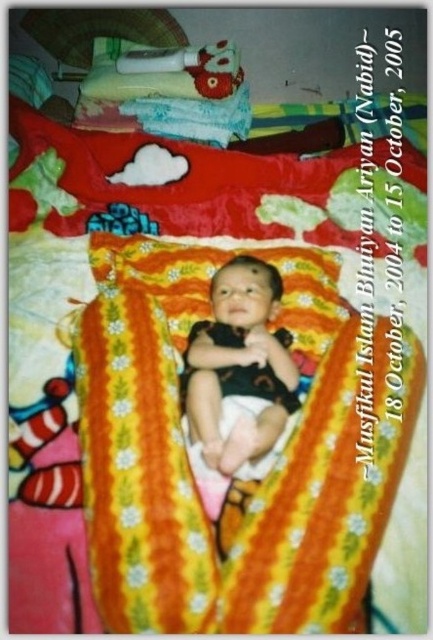
Between point (326, 518) and point (368, 163), which one is positioned in front?

Point (326, 518)

Who is taller, yellow floral blanket at center or floral cotton blanket at upper center?

Standing taller between the two is yellow floral blanket at center.

Describe the element at coordinates (271, 472) in the screenshot. I see `yellow floral blanket at center` at that location.

The image size is (433, 640). Find the location of `yellow floral blanket at center`. yellow floral blanket at center is located at coordinates (271, 472).

Does floral cotton blanket at upper center have a greater width compared to black matte onesie at center?

Correct, the width of floral cotton blanket at upper center exceeds that of black matte onesie at center.

Can you confirm if floral cotton blanket at upper center is taller than black matte onesie at center?

Indeed, floral cotton blanket at upper center has a greater height compared to black matte onesie at center.

Identify the location of floral cotton blanket at upper center. This screenshot has height=640, width=433. [x=181, y=179].

Can you confirm if yellow floral blanket at center is thinner than black matte onesie at center?

No, yellow floral blanket at center is not thinner than black matte onesie at center.

Can you confirm if yellow floral blanket at center is taller than black matte onesie at center?

Indeed, yellow floral blanket at center has a greater height compared to black matte onesie at center.

This screenshot has height=640, width=433. What do you see at coordinates (271, 472) in the screenshot? I see `yellow floral blanket at center` at bounding box center [271, 472].

You are a GUI agent. You are given a task and a screenshot of the screen. Output one action in this format:
    pyautogui.click(x=<x>, y=<y>)
    Task: Click on the yellow floral blanket at center
    The height and width of the screenshot is (640, 433).
    Given the screenshot: What is the action you would take?
    pyautogui.click(x=271, y=472)